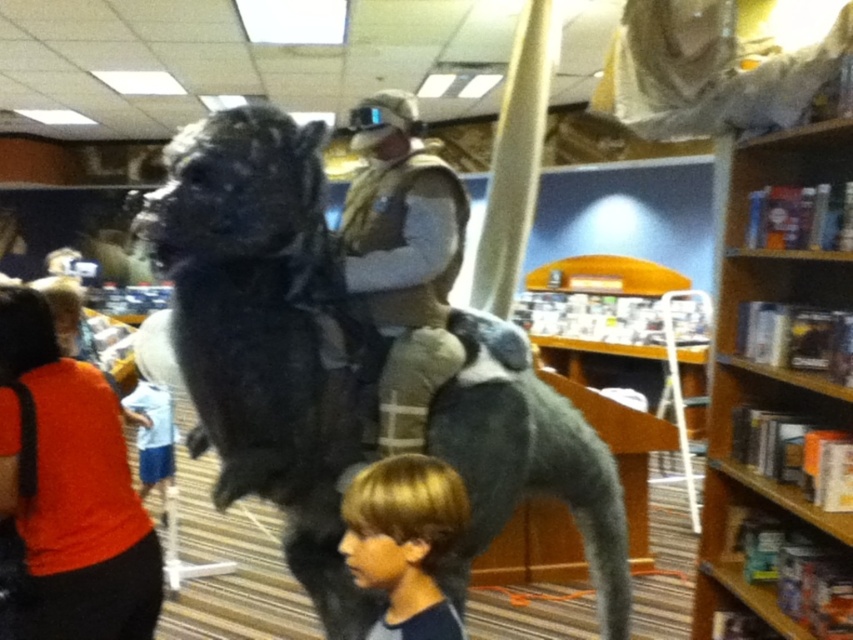
What are the coordinates of the tan fabric vest at center?

The tan fabric vest at center is located at point (403,259).